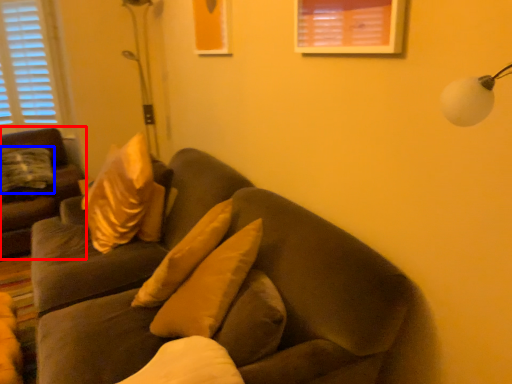
Question: Among these objects, which one is nearest to the camera, studio couch (highlighted by a red box) or pillow (highlighted by a blue box)?

Choices:
 (A) studio couch
 (B) pillow

Answer: (A)